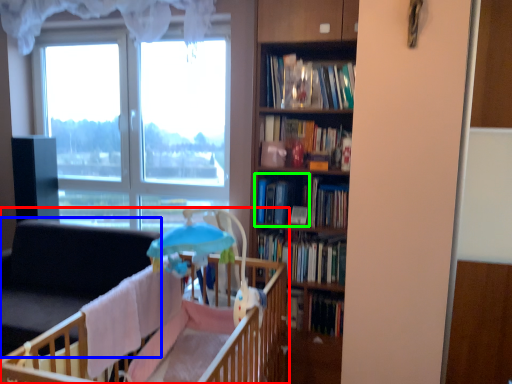
Question: Considering the real-world distances, which object is closest to infant bed (highlighted by a red box)? swivel chair (highlighted by a blue box) or book (highlighted by a green box).

Choices:
 (A) swivel chair
 (B) book

Answer: (B)